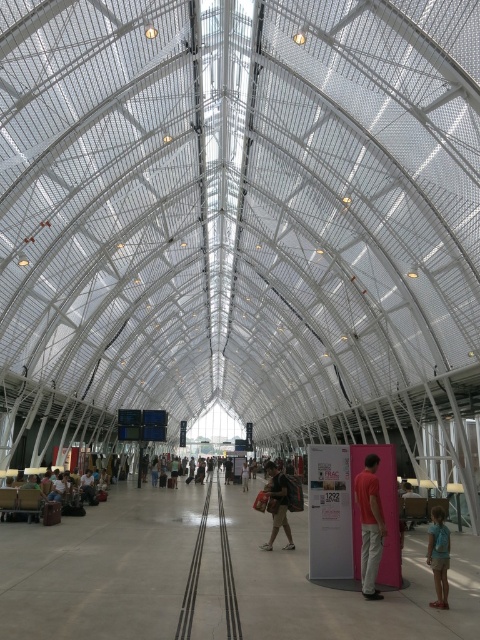
Question: Estimate the real-world distances between objects in this image. Which object is closer to the matte black backpack at center?

Choices:
 (A) pink fabric at center
 (B) blue denim shorts at lower right
 (C) dark brown leather backpack at center

Answer: (C)

Question: Is dark brown leather backpack at center to the left of pink fabric at center from the viewer's perspective?

Choices:
 (A) yes
 (B) no

Answer: (A)

Question: Considering the real-world distances, which object is farthest from the matte red shirt at center?

Choices:
 (A) blue denim shorts at lower right
 (B) dark brown leather backpack at center
 (C) dark blue jeans at center
 (D) matte black backpack at center

Answer: (B)

Question: Which object is closer to the camera taking this photo?

Choices:
 (A) matte red shirt at center
 (B) matte black backpack at center

Answer: (A)

Question: Can you confirm if matte red shirt at center is smaller than blue denim shorts at lower right?

Choices:
 (A) no
 (B) yes

Answer: (A)

Question: Does matte red shirt at center have a lesser width compared to dark blue jeans at center?

Choices:
 (A) yes
 (B) no

Answer: (A)